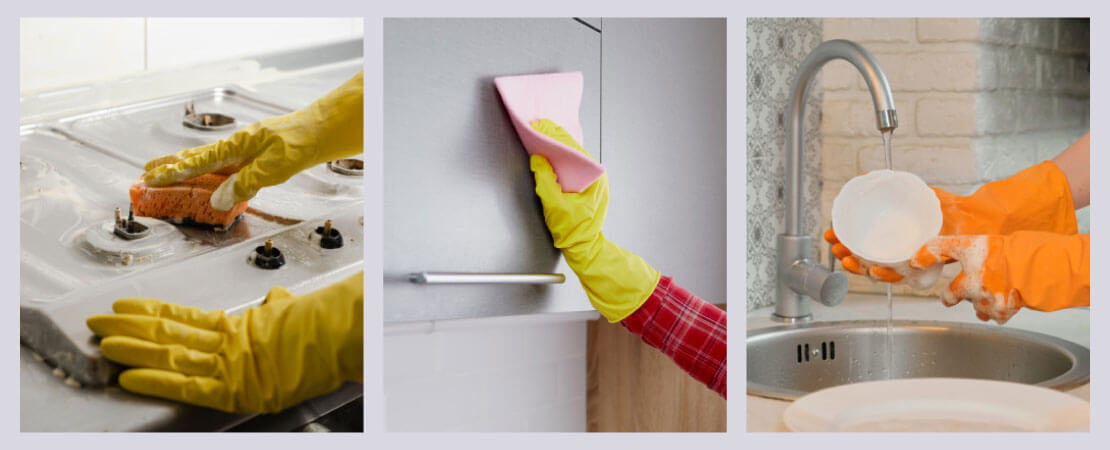
Where is `white bowl`? white bowl is located at coordinates (885, 228).